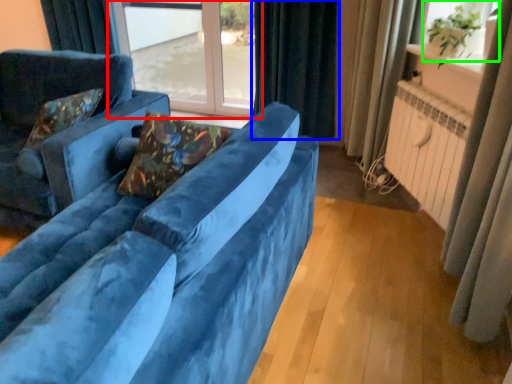
Question: Which is farther away from window (highlighted by a red box)? curtain (highlighted by a blue box) or window screen (highlighted by a green box)?

Choices:
 (A) curtain
 (B) window screen

Answer: (B)